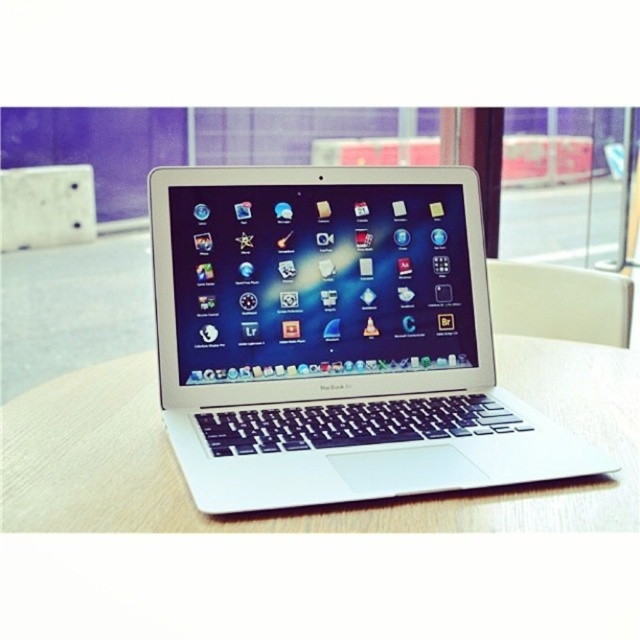
Question: Is the position of wooden table at center more distant than that of white plastic chair at right?

Choices:
 (A) yes
 (B) no

Answer: (B)

Question: Can you confirm if silver metallic laptop at center is positioned to the right of wooden table at center?

Choices:
 (A) no
 (B) yes

Answer: (A)

Question: Among these objects, which one is nearest to the camera?

Choices:
 (A) white plastic chair at right
 (B) wooden table at center
 (C) silver metallic laptop at center

Answer: (B)

Question: Which object is farther from the camera taking this photo?

Choices:
 (A) silver metallic laptop at center
 (B) wooden table at center

Answer: (A)

Question: Is silver metallic laptop at center closer to the viewer compared to white plastic chair at right?

Choices:
 (A) yes
 (B) no

Answer: (A)

Question: Among these points, which one is nearest to the camera?

Choices:
 (A) (422, 451)
 (B) (524, 316)

Answer: (A)